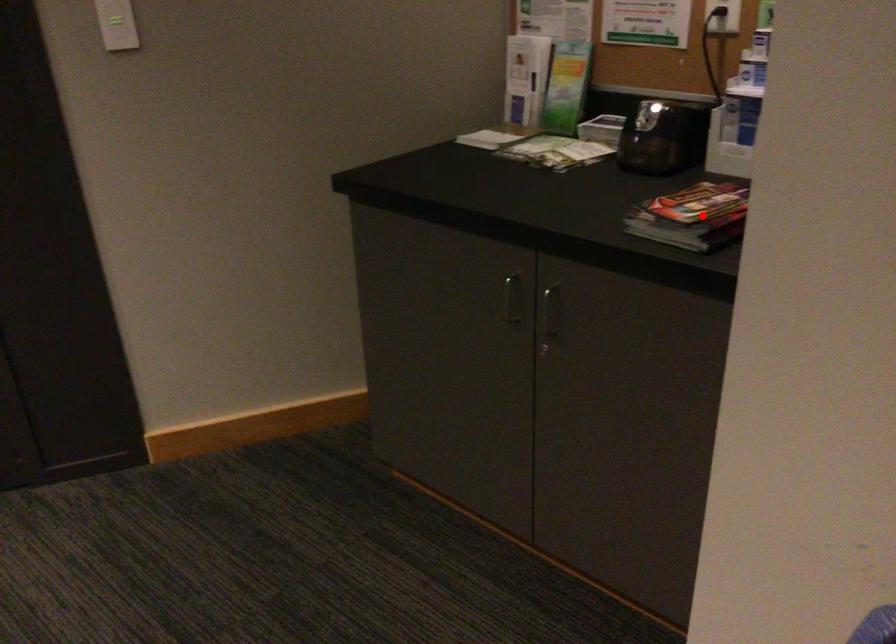
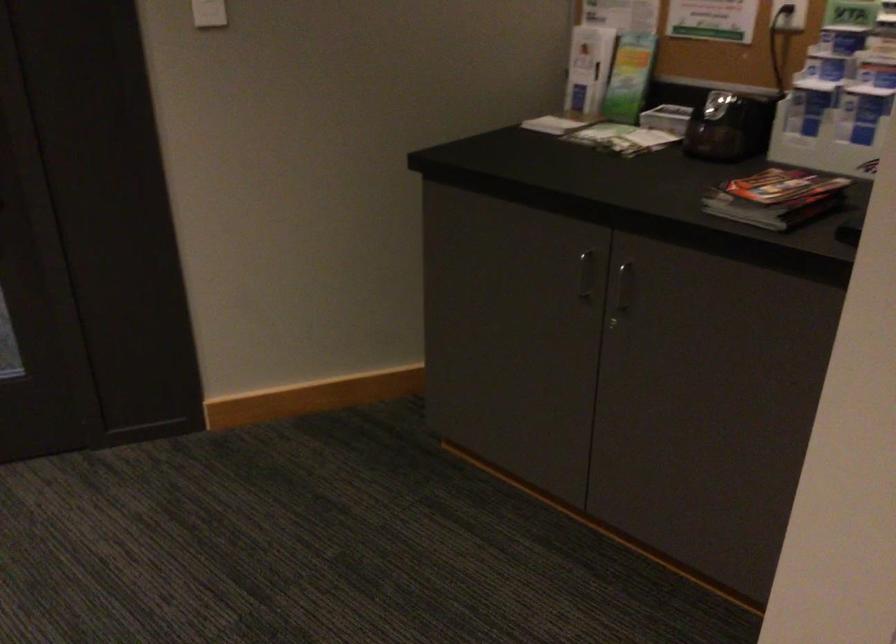
The point at the highlighted location is marked in the first image. Where is the corresponding point in the second image?

(776, 198)